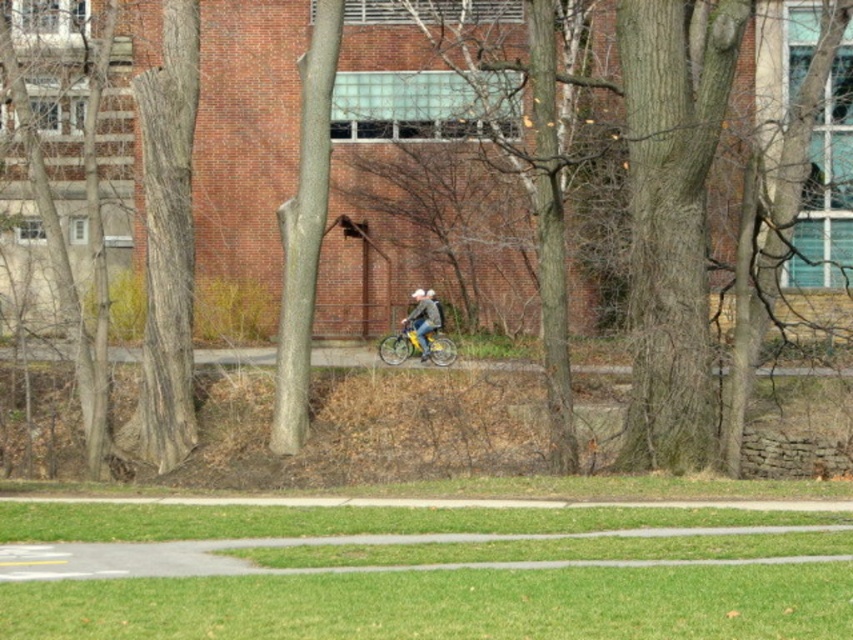
Looking at this image, who is taller, yellow matte bicycle at center or denim jacket at center?

With more height is denim jacket at center.

Does yellow matte bicycle at center have a greater height compared to denim jacket at center?

No.

Measure the distance between point (410, 342) and camera.

They are 42.01 meters apart.

Locate an element on the screen. yellow matte bicycle at center is located at coordinates (416, 346).